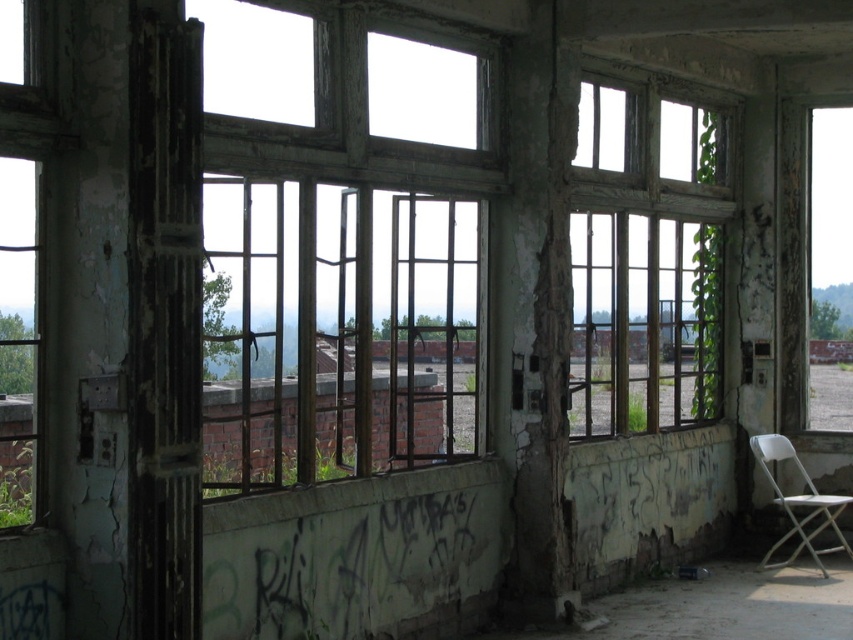
Is wooden window at center shorter than white plastic folding chair at lower right?

No.

Who is more forward, (581, 305) or (840, 547)?

Point (581, 305) is in front.

Where is `wooden window at center`? Image resolution: width=853 pixels, height=640 pixels. wooden window at center is located at coordinates (648, 260).

Which is in front, point (585, 115) or point (793, 148)?

Point (585, 115) is in front.

Between point (677, 403) and point (810, 298), which one is positioned behind?

Positioned behind is point (810, 298).

This screenshot has height=640, width=853. In order to click on wooden window at center in this screenshot , I will do `click(648, 260)`.

Between rusty metal window at right and white plastic folding chair at lower right, which one appears on the left side from the viewer's perspective?

From the viewer's perspective, white plastic folding chair at lower right appears more on the left side.

Does point (810, 220) lie in front of point (801, 532)?

No, (810, 220) is behind (801, 532).

This screenshot has width=853, height=640. I want to click on rusty metal window at right, so click(793, 262).